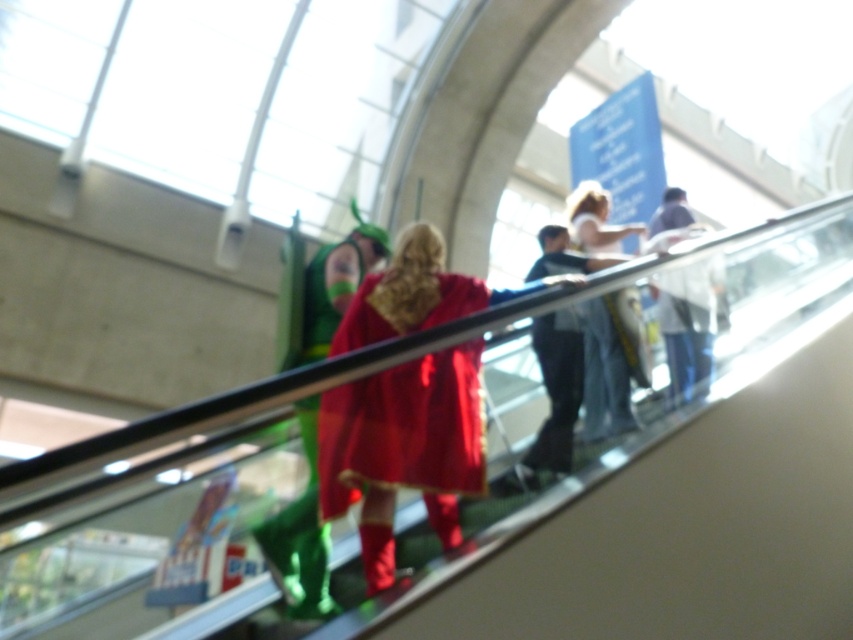
Which is below, velvet red cape at center or denim jeans at center?

velvet red cape at center is below.

Does velvet red cape at center appear over denim jeans at center?

No, velvet red cape at center is not above denim jeans at center.

Does point (410, 472) lie in front of point (582, 202)?

Yes.

Locate an element on the screen. velvet red cape at center is located at coordinates (403, 429).